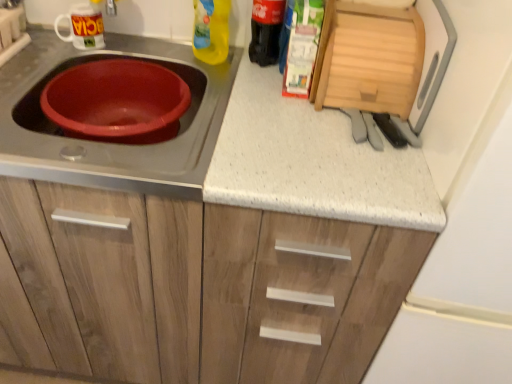
Question: Should I look upward or downward to see white speckled laminate at center?

Choices:
 (A) up
 (B) down

Answer: (B)

Question: From the image's perspective, is white glossy mug at upper left, the second appliance in the right-to-left sequence, on top of black glass bottle at upper right, positioned as the 1th bottle in right-to-left order?

Choices:
 (A) yes
 (B) no

Answer: (B)

Question: Is white glossy mug at upper left, placed as the first appliance when sorted from left to right, shorter than black glass bottle at upper right, positioned as the 1th bottle in right-to-left order?

Choices:
 (A) yes
 (B) no

Answer: (A)

Question: Can you see white glossy mug at upper left, the second appliance in the right-to-left sequence, touching black glass bottle at upper right, positioned as the 1th bottle in right-to-left order?

Choices:
 (A) no
 (B) yes

Answer: (A)

Question: Is white glossy mug at upper left, placed as the first appliance when sorted from left to right, taller than black glass bottle at upper right, which appears as the 2th bottle when viewed from the left?

Choices:
 (A) yes
 (B) no

Answer: (B)

Question: Is white glossy mug at upper left, placed as the first appliance when sorted from left to right, thinner than black glass bottle at upper right, which appears as the 2th bottle when viewed from the left?

Choices:
 (A) no
 (B) yes

Answer: (A)

Question: Is white glossy mug at upper left, placed as the first appliance when sorted from left to right, positioned in front of black glass bottle at upper right, positioned as the 1th bottle in right-to-left order?

Choices:
 (A) yes
 (B) no

Answer: (B)

Question: Considering the relative positions of white speckled laminate at center and white glossy mug at upper left, the second appliance in the right-to-left sequence, in the image provided, is white speckled laminate at center to the right of white glossy mug at upper left, the second appliance in the right-to-left sequence, from the viewer's perspective?

Choices:
 (A) no
 (B) yes

Answer: (B)

Question: Is white glossy mug at upper left, the second appliance in the right-to-left sequence, completely or partially inside white speckled laminate at center?

Choices:
 (A) no
 (B) yes

Answer: (A)

Question: From a real-world perspective, does white speckled laminate at center sit lower than white glossy mug at upper left, the second appliance in the right-to-left sequence?

Choices:
 (A) no
 (B) yes

Answer: (B)

Question: From a real-world perspective, is white speckled laminate at center on white glossy mug at upper left, the second appliance in the right-to-left sequence?

Choices:
 (A) no
 (B) yes

Answer: (A)

Question: Considering the relative sizes of white speckled laminate at center and white glossy mug at upper left, placed as the first appliance when sorted from left to right, in the image provided, is white speckled laminate at center taller than white glossy mug at upper left, placed as the first appliance when sorted from left to right,?

Choices:
 (A) yes
 (B) no

Answer: (A)

Question: Considering the relative sizes of white speckled laminate at center and white glossy mug at upper left, placed as the first appliance when sorted from left to right, in the image provided, is white speckled laminate at center smaller than white glossy mug at upper left, placed as the first appliance when sorted from left to right,?

Choices:
 (A) yes
 (B) no

Answer: (B)

Question: Is white glossy mug at upper left, placed as the first appliance when sorted from left to right, outside of yellow plastic bottle at upper center, the 1th bottle viewed from the left?

Choices:
 (A) yes
 (B) no

Answer: (A)